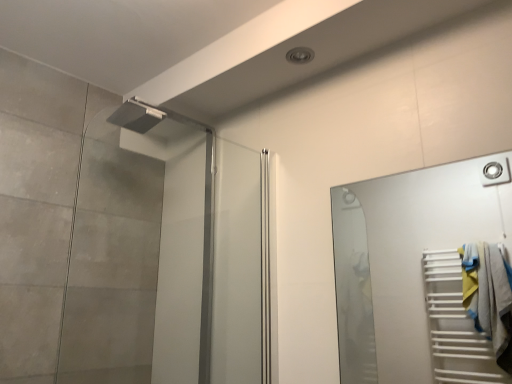
Question: Is matte silver shower head at upper left aimed at white glossy towel rack at right?

Choices:
 (A) yes
 (B) no

Answer: (A)

Question: Would you say matte silver shower head at upper left contains white glossy towel rack at right?

Choices:
 (A) yes
 (B) no

Answer: (B)

Question: Is matte silver shower head at upper left looking in the opposite direction of white glossy towel rack at right?

Choices:
 (A) yes
 (B) no

Answer: (B)

Question: From the image's perspective, would you say matte silver shower head at upper left is positioned over white glossy towel rack at right?

Choices:
 (A) no
 (B) yes

Answer: (B)

Question: Does matte silver shower head at upper left lie behind white glossy towel rack at right?

Choices:
 (A) yes
 (B) no

Answer: (A)

Question: Are matte silver shower head at upper left and white glossy towel rack at right making contact?

Choices:
 (A) no
 (B) yes

Answer: (A)

Question: Is white glossy towel rack at right positioned with its back to matte silver shower head at upper left?

Choices:
 (A) no
 (B) yes

Answer: (A)

Question: Does white glossy towel rack at right lie behind matte silver shower head at upper left?

Choices:
 (A) no
 (B) yes

Answer: (A)

Question: Considering the relative positions of white glossy towel rack at right and matte silver shower head at upper left in the image provided, is white glossy towel rack at right in front of matte silver shower head at upper left?

Choices:
 (A) no
 (B) yes

Answer: (B)

Question: Can you confirm if white glossy towel rack at right is bigger than matte silver shower head at upper left?

Choices:
 (A) no
 (B) yes

Answer: (A)

Question: Does white glossy towel rack at right have a smaller size compared to matte silver shower head at upper left?

Choices:
 (A) no
 (B) yes

Answer: (B)

Question: From a real-world perspective, is white glossy towel rack at right positioned under matte silver shower head at upper left based on gravity?

Choices:
 (A) yes
 (B) no

Answer: (A)

Question: From their relative heights in the image, would you say matte silver shower head at upper left is taller or shorter than white glossy towel rack at right?

Choices:
 (A) short
 (B) tall

Answer: (B)